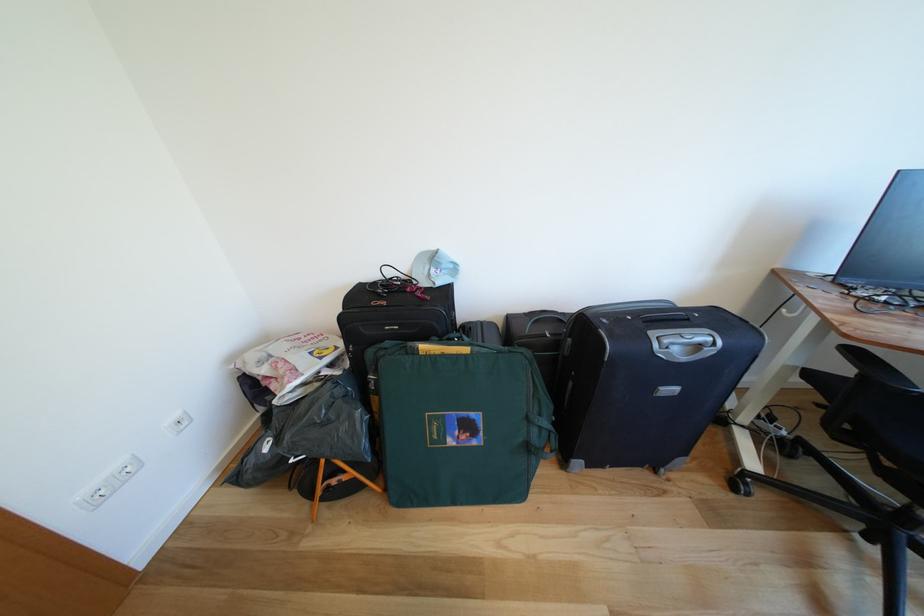
Describe the element at coordinates (690, 342) in the screenshot. This screenshot has height=616, width=924. I see `the black suitcase handle` at that location.